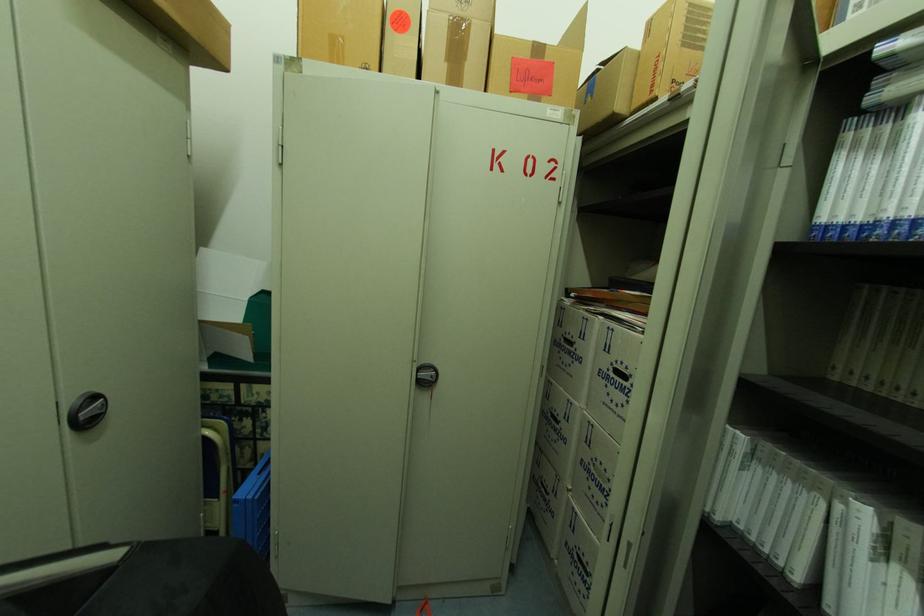
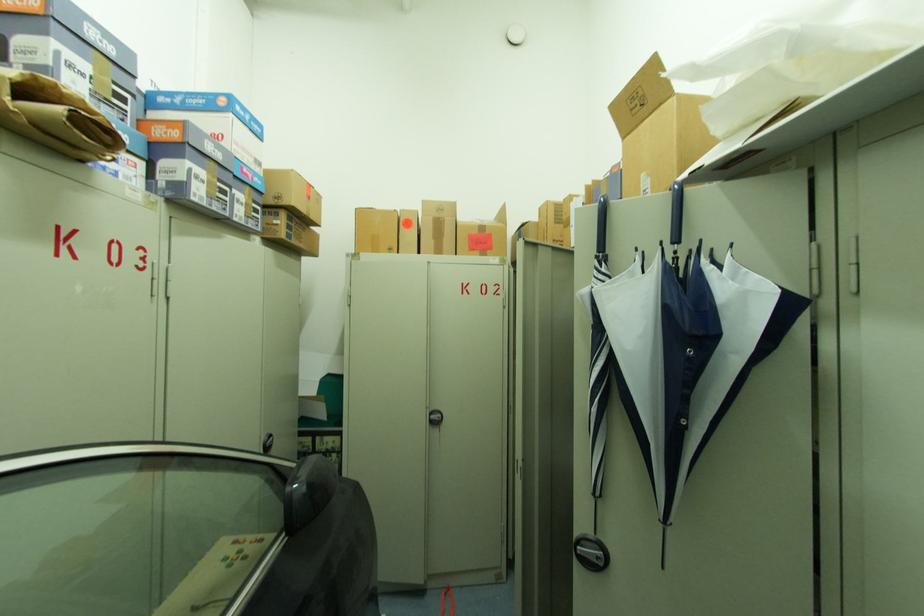
Question: Which direction would the cameraman need to move to produce the second image? Reply with the corresponding letter.

Choices:
 (A) Left
 (B) Right
 (C) Forward
 (D) Backward

Answer: (D)